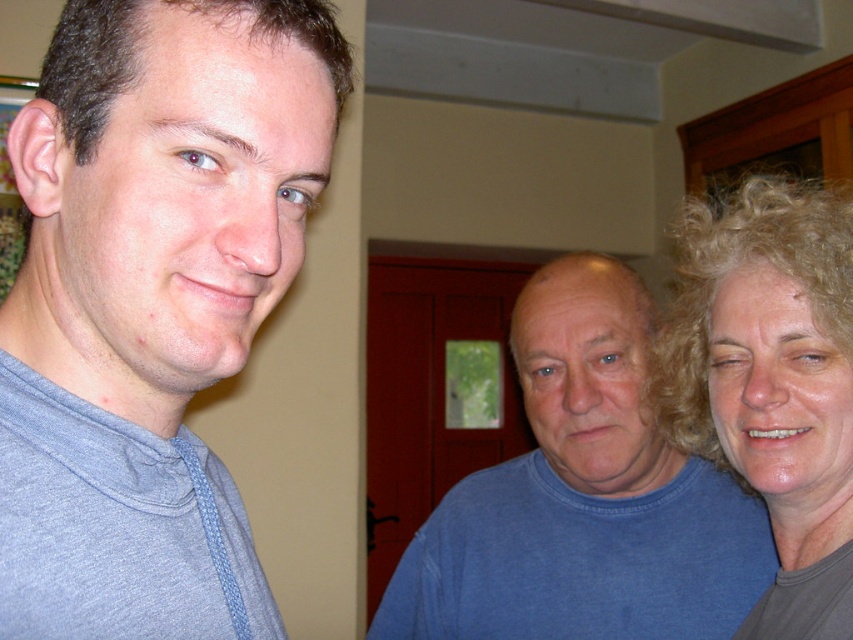
You are trying to determine the spatial relationship between the blue cotton shirt at center and the curly blonde hair at right in the image. Which of these two occupies more visual space?

The curly blonde hair at right occupies more visual space than the blue cotton shirt at center.

You are a photographer setting up a photo shoot in a living room. You need to arrange two subjects so that one is taller than the other. The subjects are the blue cotton shirt at center and the curly blonde hair at right. Which subject should you place higher in the frame to maintain the existing height relationship?

The blue cotton shirt at center is taller than curly blonde hair at right, so to maintain the existing height relationship, you should place the blue cotton shirt at center higher in the frame than the curly blonde hair at right.

You are taking a photo of three people standing in a living room. You notice the gray cotton shirt at left and the curly blonde hair at right. Which object is closer to the bottom of the photo?

The gray cotton shirt at left is positioned under curly blonde hair at right, so it is closer to the bottom of the photo.